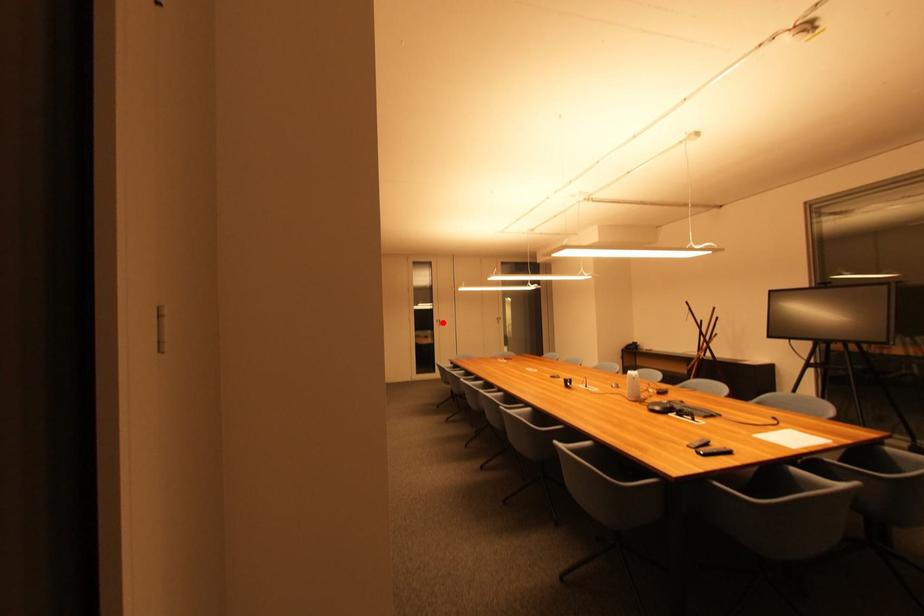
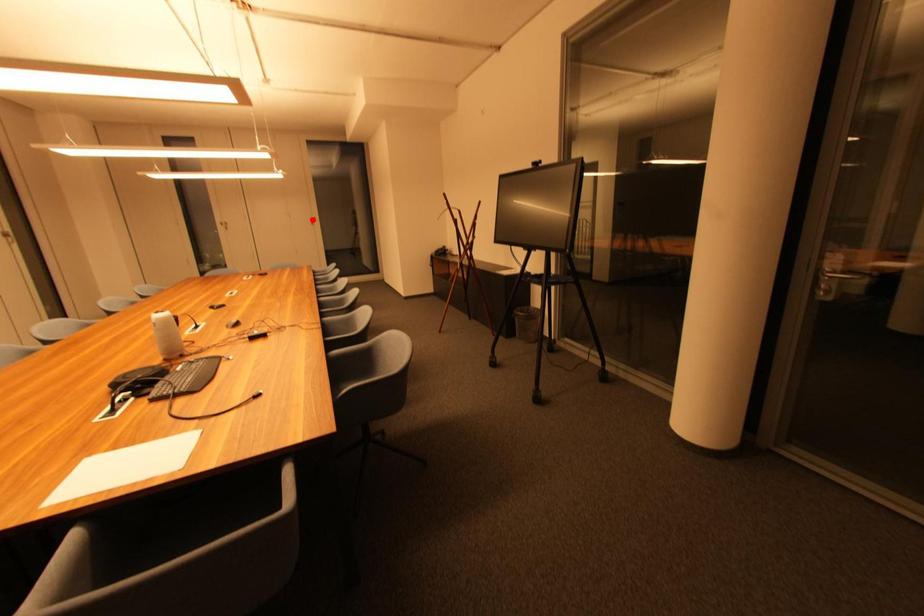
I am providing you with two images of the same scene from different viewpoints. A red point is marked on the first image and another point is marked on the second image. Do the highlighted points in image1 and image2 indicate the same real-world spot?

No